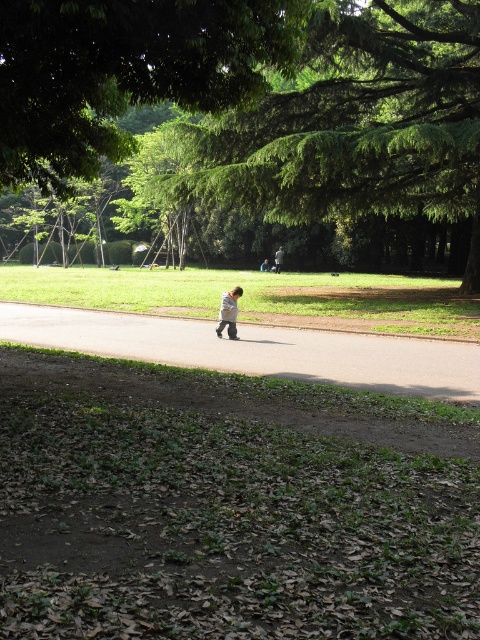
You are standing at the point labeled as point (202, 51). You want to walk to the grassy area in the background. Is the path between you and the grassy area clear of any obstacles?

The path between you and the grassy area is clear of any obstacles.